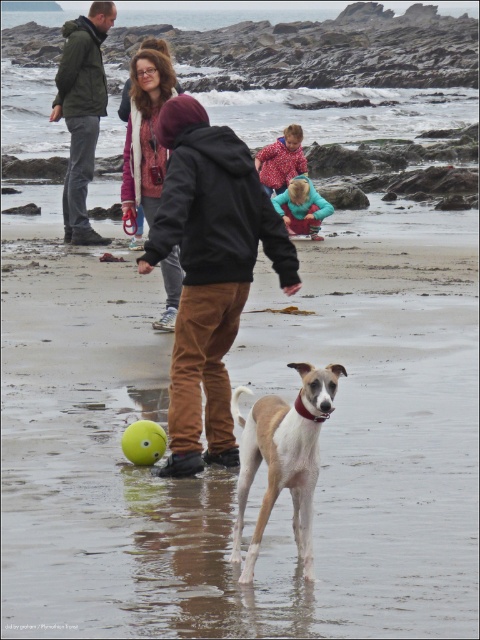
Does dark green jacket at upper left have a greater height compared to red polka dot coat at center?

Yes.

Can you confirm if dark green jacket at upper left is positioned to the right of red polka dot coat at center?

In fact, dark green jacket at upper left is to the left of red polka dot coat at center.

Where is `dark green jacket at upper left`? dark green jacket at upper left is located at coordinates (82, 113).

At what (x,y) coordinates should I click in order to perform the action: click on dark green jacket at upper left. Please return your answer as a coordinate pair (x, y). The image size is (480, 640). Looking at the image, I should click on (82, 113).

Between matte purple jacket at center and blue fleece jacket at center, which one has less height?

Standing shorter between the two is blue fleece jacket at center.

Does matte purple jacket at center appear on the left side of blue fleece jacket at center?

Yes, matte purple jacket at center is to the left of blue fleece jacket at center.

Is point (156, 56) behind point (300, 214)?

No, it is in front of (300, 214).

You are a GUI agent. You are given a task and a screenshot of the screen. Output one action in this format:
    pyautogui.click(x=<x>, y=<y>)
    Task: Click on the matte purple jacket at center
    The height and width of the screenshot is (640, 480).
    Given the screenshot: What is the action you would take?
    pyautogui.click(x=145, y=131)

Can you confirm if brown suede jacket at center is wider than red polka dot coat at center?

Yes, brown suede jacket at center is wider than red polka dot coat at center.

Is point (207, 259) positioned after point (286, 156)?

That is False.

The image size is (480, 640). What are the coordinates of `brown suede jacket at center` in the screenshot? It's located at (208, 272).